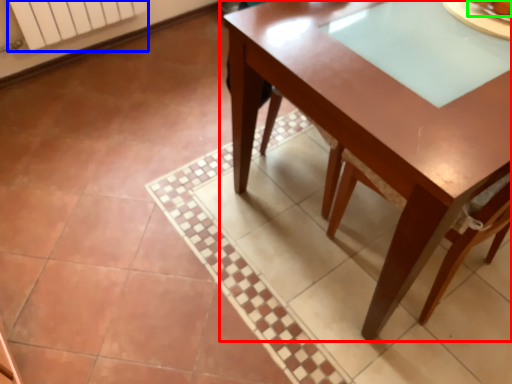
Question: Based on their relative distances, which object is farther from table (highlighted by a red box)? Choose from radiator (highlighted by a blue box) and food (highlighted by a green box).

Choices:
 (A) radiator
 (B) food

Answer: (A)